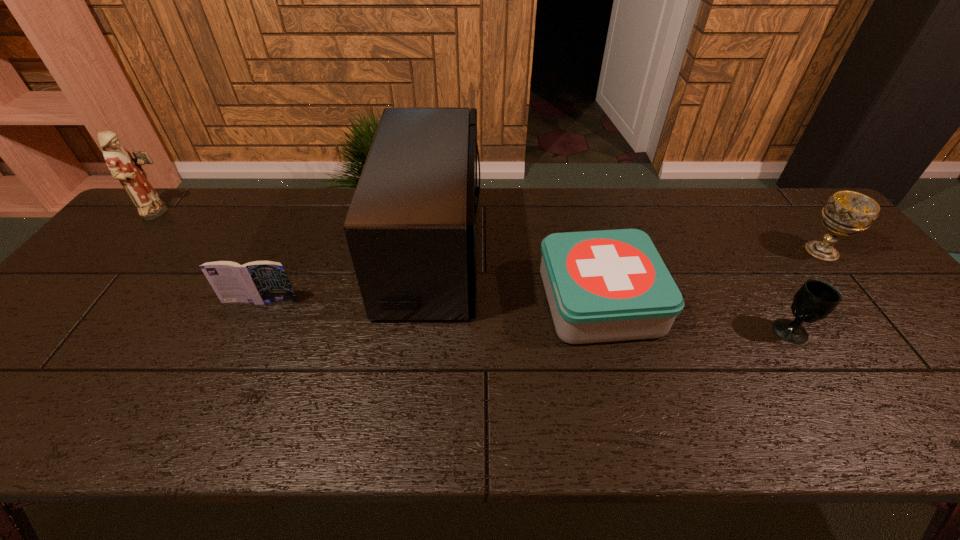
Where is `vacant space at the left edge of the desktop`? Image resolution: width=960 pixels, height=540 pixels. vacant space at the left edge of the desktop is located at coordinates (156, 246).

The height and width of the screenshot is (540, 960). In the image, there is a desktop. Identify the location of vacant space at the far left corner. (175, 206).

What are the coordinates of `vacant space that's between the third object from right to left and the nearer chalice` in the screenshot? It's located at (696, 316).

At what (x,y) coordinates should I click in order to perform the action: click on vacant region between the figurine and the microwave_oven. Please return your answer as a coordinate pair (x, y). The height and width of the screenshot is (540, 960). Looking at the image, I should click on (297, 231).

This screenshot has height=540, width=960. What are the coordinates of `unoccupied area between the left chalice and the fourth object from left to right` in the screenshot? It's located at (696, 316).

This screenshot has width=960, height=540. I want to click on object that is the fifth nearest to the fourth object from right to left, so click(846, 213).

Locate an element on the screen. object that stands as the fifth closest to the book is located at coordinates (846, 213).

The height and width of the screenshot is (540, 960). I want to click on free space that satisfies the following two spatial constraints: 1. on the front-facing side of the microwave_oven; 2. on the front cover of the book, so click(426, 301).

Identify the location of free space that satisfies the following two spatial constraints: 1. on the front-facing side of the leftmost object; 2. on the left side of the rightmost object. (128, 252).

Image resolution: width=960 pixels, height=540 pixels. What are the coordinates of `vacant space that satisfies the following two spatial constraints: 1. on the front-facing side of the third object from left to right; 2. on the right side of the shorter chalice` in the screenshot? It's located at (423, 331).